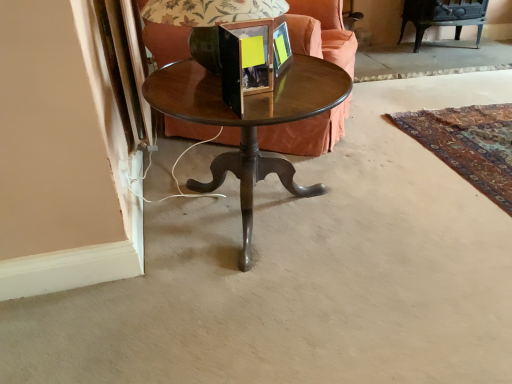
Locate an element on the screen. The image size is (512, 384). free point to the right of wooden picture frame at center, arranged as the 2th picture frame when viewed from the back is located at coordinates (309, 99).